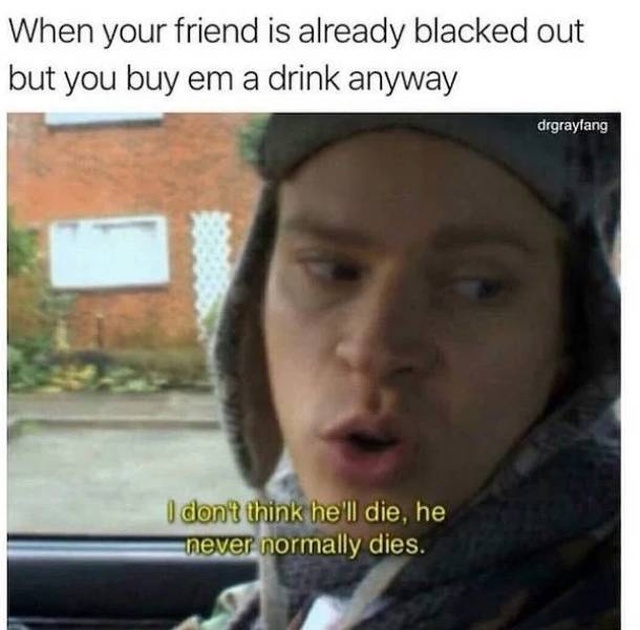
Where is `brick wall`? brick wall is located at coordinates (102, 174), (116, 304), (202, 178), (27, 169).